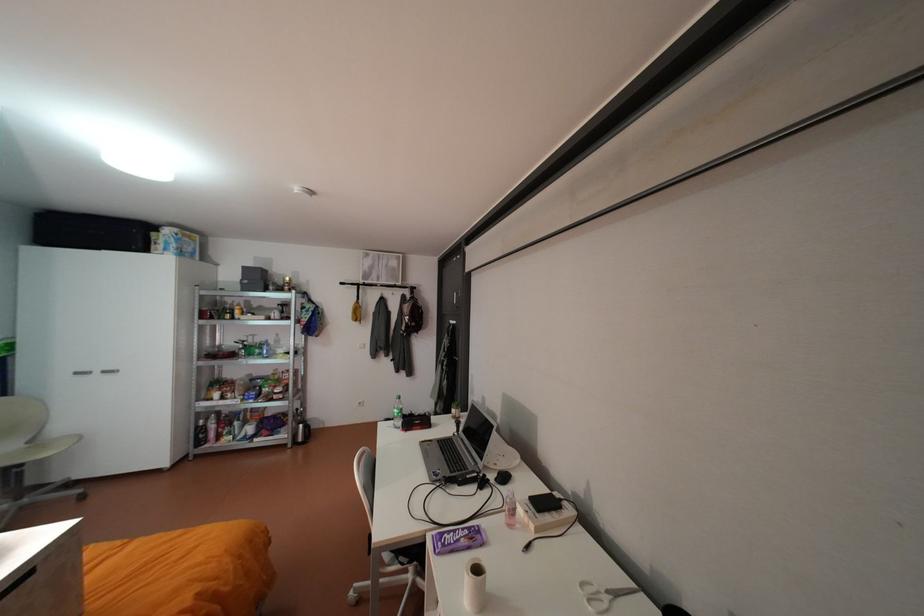
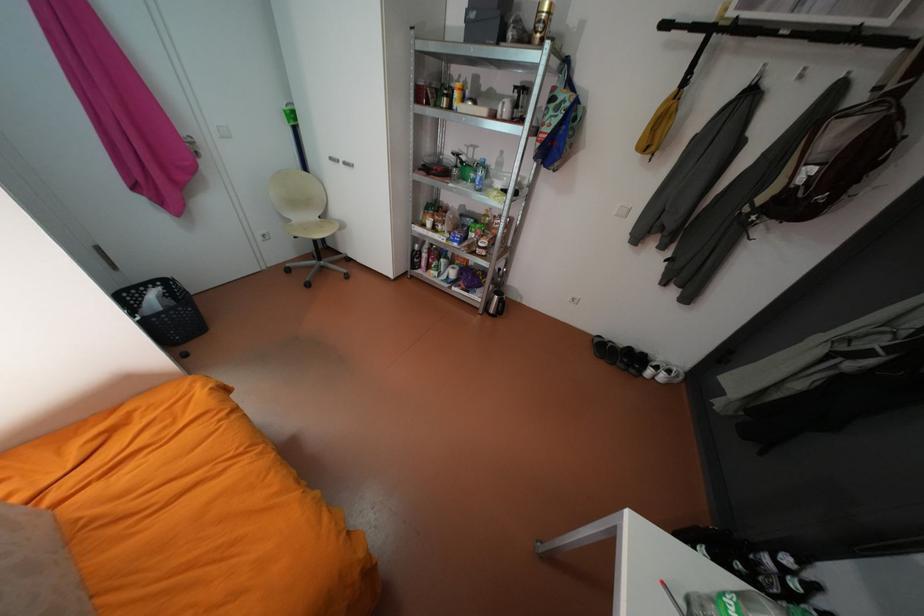
Find the pixel in the second image that matches pixel 289 288 in the first image.

(533, 39)